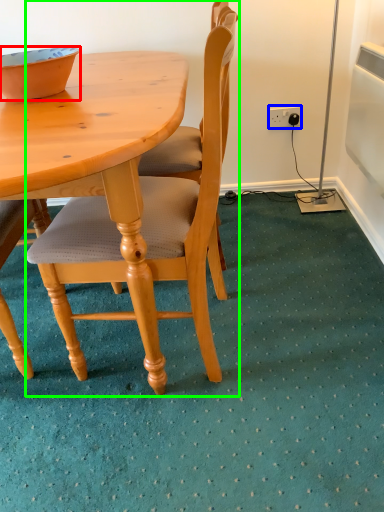
Question: Which object is the farthest from bowl (highlighted by a red box)? Choose among these: power outlet (highlighted by a blue box) or chair (highlighted by a green box).

Choices:
 (A) power outlet
 (B) chair

Answer: (A)